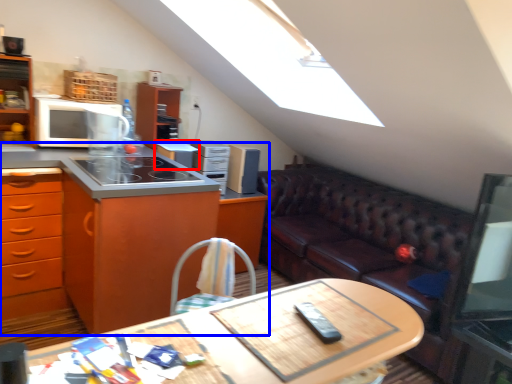
Question: Among these objects, which one is nearest to the camera, appliance (highlighted by a red box) or cabinetry (highlighted by a blue box)?

Choices:
 (A) appliance
 (B) cabinetry

Answer: (B)